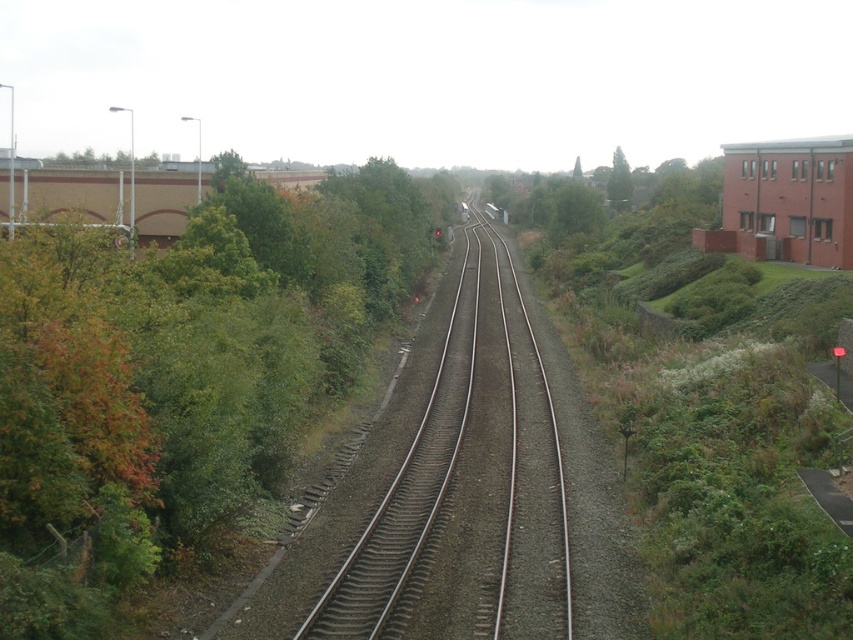
You are a train engineer planning to navigate a narrow section of the railway. You observe the green leafy tree at left and the smooth asphalt train track at center. Which object is wider, potentially affecting the train path?

The green leafy tree at left might be wider than the smooth asphalt train track at center, so it could potentially obstruct the train path.

From the picture: You are a landscape architect designing a walking path between the green leafy tree at left and the green leafy tree at upper center. Given that the path must be exactly 300 feet long, will the path be long enough to connect both trees?

The distance between the green leafy tree at left and the green leafy tree at upper center is 305.44 feet. Since the path is only 300 feet long, it will be 5.44 feet short and cannot fully connect both trees.

Based on the photo, you are a hiker standing on the bridge overlooking the railway. You notice the green leafy tree at left and the smooth asphalt train track at center. Which object appears bigger in your view?

The green leafy tree at left appears bigger in your view because it has a larger size compared to the smooth asphalt train track at center.